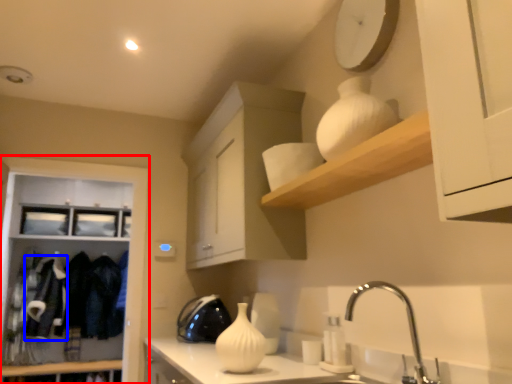
Question: Which object appears closest to the camera in this image, cabinetry (highlighted by a red box) or laundry (highlighted by a blue box)?

Choices:
 (A) cabinetry
 (B) laundry

Answer: (A)